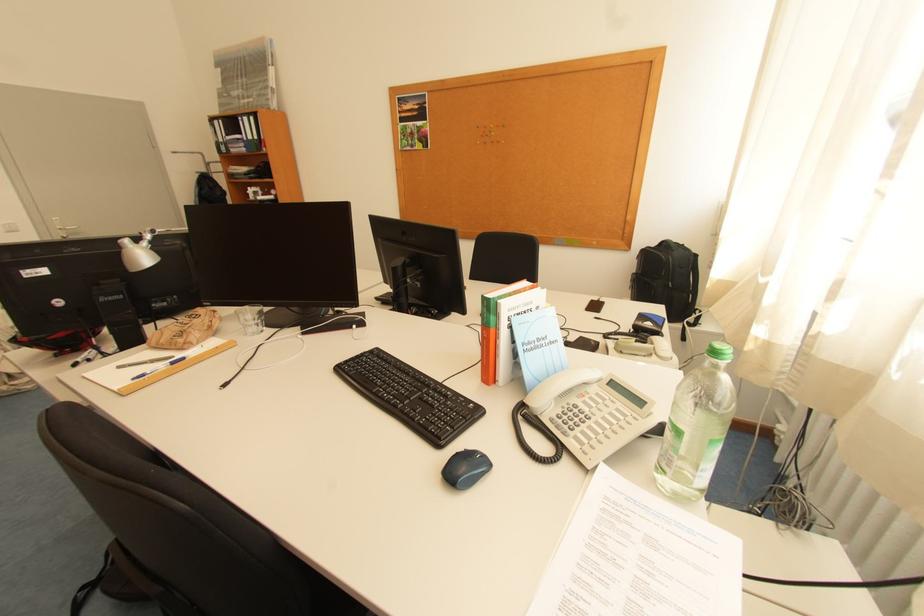
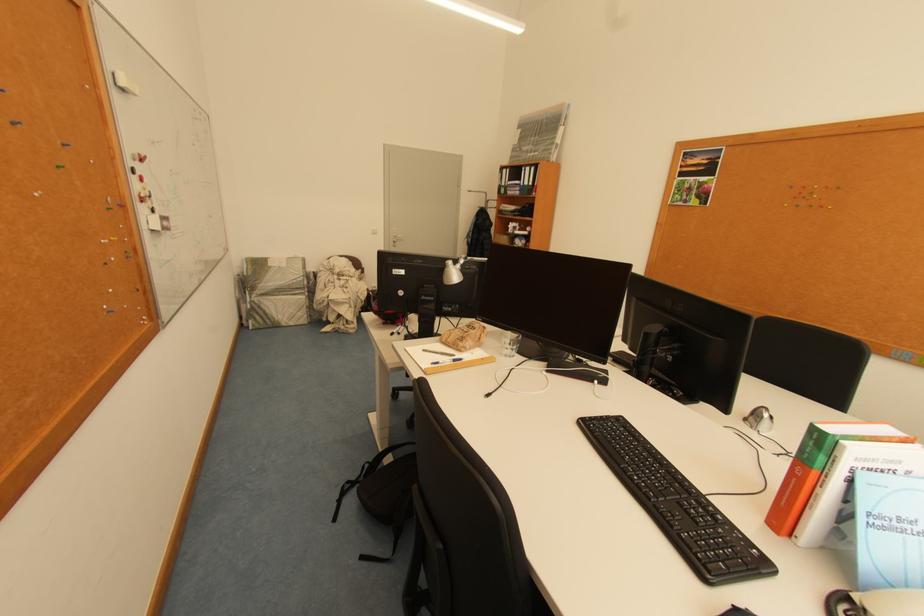
Question: The images are taken continuously from a first-person perspective. In which direction is your viewpoint rotating?

Choices:
 (A) Left
 (B) Right
 (C) Up
 (D) Down

Answer: (A)